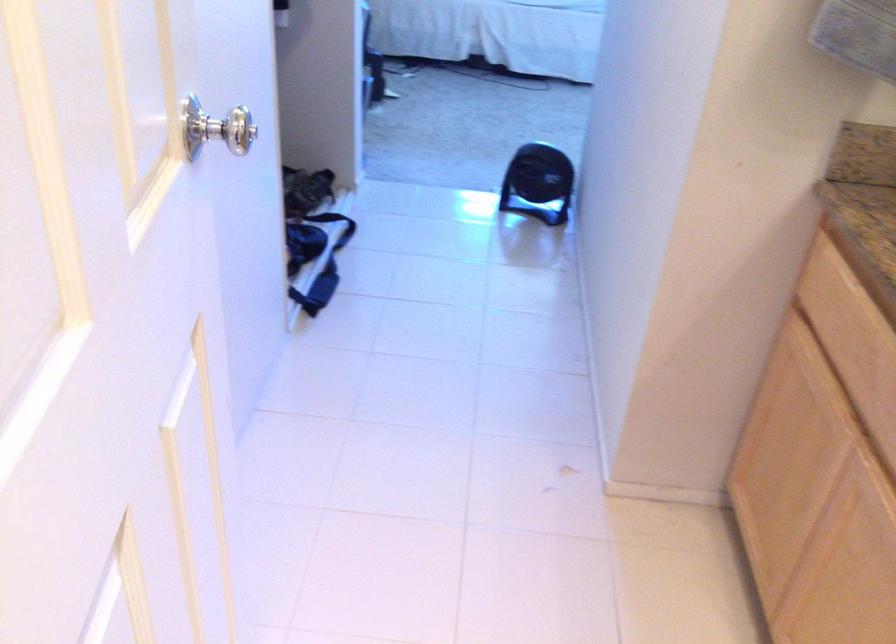
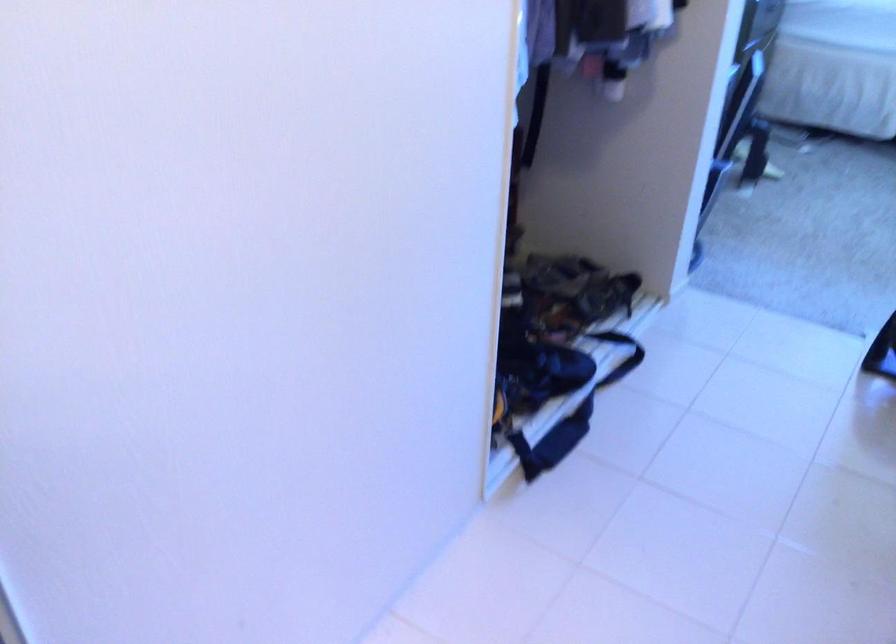
Locate, in the second image, the point that corresponds to (x=342, y=232) in the first image.

(621, 355)